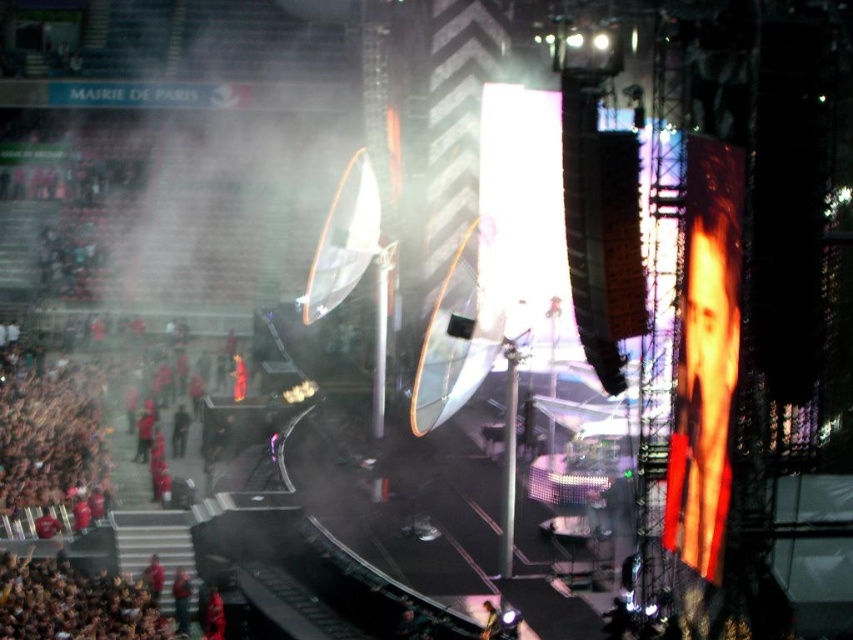
You are a photographer at the concert and need to capture a photo of both the red fabric jacket at lower left and the shiny black guitar at center. The camera lens has a limited field of view. Can you fit both objects into the frame without moving the camera?

The red fabric jacket at lower left might be wider than the shiny black guitar at center, so there is a possibility that the jacket is wider. However, since the exact width difference isn not specified, it is uncertain whether both can fit into the frame without moving the camera. Adjust the zoom or position slightly to ensure both are visible.

You are a photographer trying to capture a clear shot of both the red fabric jacket at lower left and the red fabric person at lower left. Based on their sizes, which one would appear bigger in your photo?

The red fabric jacket at lower left would appear bigger in the photo since it has a larger size compared to the red fabric person at lower left.